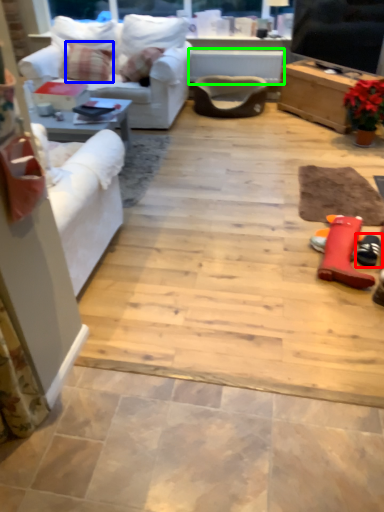
Question: Considering the real-world distances, which object is closest to footwear (highlighted by a red box)? pillow (highlighted by a blue box) or table (highlighted by a green box).

Choices:
 (A) pillow
 (B) table

Answer: (B)